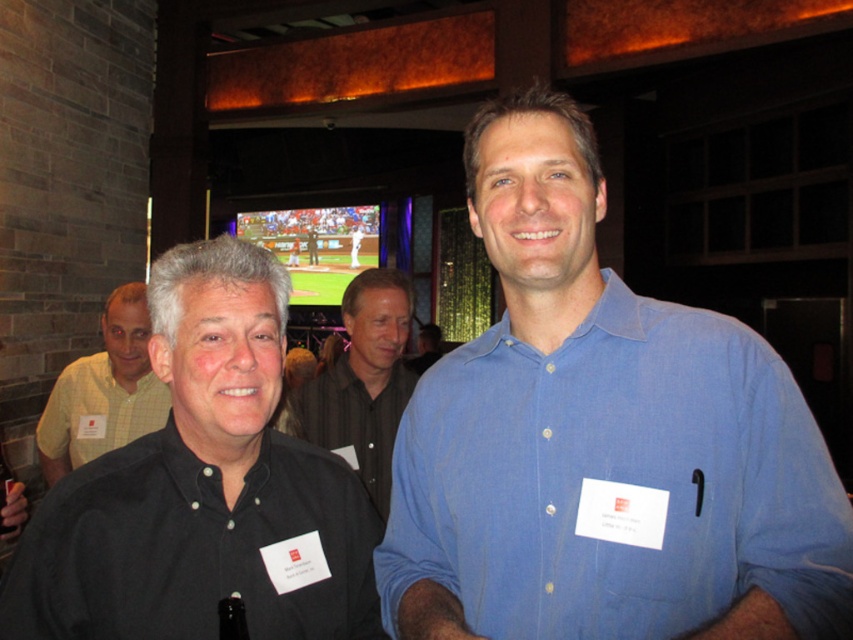
Does point (635, 376) come behind point (61, 490)?

No, it is not.

Is blue cotton shirt at center smaller than black matte shirt at center?

Yes.

Who is more distant from viewer, (489, 556) or (259, 248)?

The point (259, 248) is more distant.

What are the coordinates of `blue cotton shirt at center` in the screenshot? It's located at (616, 481).

Can you confirm if black matte shirt at center is shorter than checkered fabric shirt at left?

Correct, black matte shirt at center is not as tall as checkered fabric shirt at left.

Does black matte shirt at center have a greater height compared to checkered fabric shirt at left?

No, black matte shirt at center is not taller than checkered fabric shirt at left.

The image size is (853, 640). Find the location of `black matte shirt at center`. black matte shirt at center is located at coordinates (204, 488).

How far apart are black matte shirt at center and black shirt at center?

black matte shirt at center is 3.62 feet away from black shirt at center.

Does black matte shirt at center appear under black shirt at center?

Yes.

At what (x,y) coordinates should I click in order to perform the action: click on black matte shirt at center. Please return your answer as a coordinate pair (x, y). Looking at the image, I should click on (204, 488).